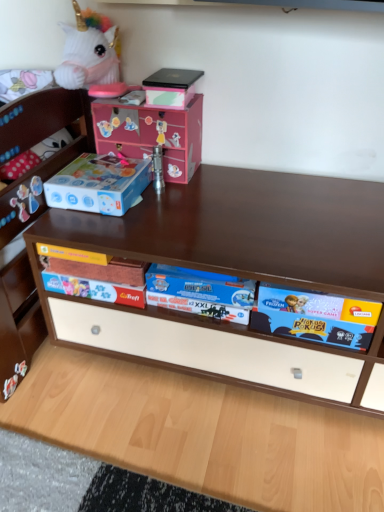
Find the location of `blue cardboard game box at center`. blue cardboard game box at center is located at coordinates (286, 313).

This screenshot has height=512, width=384. What do you see at coordinates (171, 87) in the screenshot?
I see `matte black box at upper center` at bounding box center [171, 87].

Find the location of a particular element. blue cardboard game box at center is located at coordinates (286, 313).

Between blue cardboard storage box at left and matte black box at upper center, which one appears on the right side from the viewer's perspective?

matte black box at upper center is more to the right.

Considering their positions, is blue cardboard storage box at left located in front of or behind matte black box at upper center?

blue cardboard storage box at left is in front of matte black box at upper center.

Does blue cardboard storage box at left have a larger size compared to matte black box at upper center?

Indeed, blue cardboard storage box at left has a larger size compared to matte black box at upper center.

Is the position of pink cardboard box at upper center more distant than that of matte black box at upper center?

Yes, pink cardboard box at upper center is further from the camera.

From a real-world perspective, which object rests below the other?

In real-world perspective, pink cardboard box at upper center is lower.

Can you see pink cardboard box at upper center touching matte black box at upper center?

No, pink cardboard box at upper center is not beside matte black box at upper center.

Which object is positioned more to the left, pink cardboard box at upper center or matte black box at upper center?

pink cardboard box at upper center.

Consider the image. From the image's perspective, who appears lower, pink cardboard box at upper center or blue cardboard game box at center?

blue cardboard game box at center appears lower in the image.

Is pink cardboard box at upper center touching blue cardboard game box at center?

No, pink cardboard box at upper center is not making contact with blue cardboard game box at center.

Can you tell me how much pink cardboard box at upper center and blue cardboard game box at center differ in facing direction?

0.0483 degrees.

Which object is positioned more to the left, pink cardboard box at upper center or blue cardboard game box at center?

pink cardboard box at upper center.

Measure the distance from pink cardboard box at upper center to blue cardboard storage box at left.

pink cardboard box at upper center and blue cardboard storage box at left are 12.67 centimeters apart.

Consider the image. Are pink cardboard box at upper center and blue cardboard storage box at left located far from each other?

pink cardboard box at upper center is near blue cardboard storage box at left, not far away.

Consider the image. From the image's perspective, is pink cardboard box at upper center located above or below blue cardboard storage box at left?

pink cardboard box at upper center is above blue cardboard storage box at left.

Which is further, (196,133) or (118,207)?

The point (196,133) is farther.

Does blue cardboard storage box at left have a greater height compared to blue cardboard game box at center?

Incorrect, the height of blue cardboard storage box at left is not larger of that of blue cardboard game box at center.

How far apart are blue cardboard storage box at left and blue cardboard game box at center?

blue cardboard storage box at left and blue cardboard game box at center are 11.80 inches apart from each other.

Is blue cardboard game box at center at the back of blue cardboard storage box at left?

No, blue cardboard storage box at left is not facing the opposite direction of blue cardboard game box at center.

Considering the sizes of objects blue cardboard storage box at left and blue cardboard game box at center in the image provided, who is bigger, blue cardboard storage box at left or blue cardboard game box at center?

blue cardboard game box at center.

Which point is more forward, (169, 94) or (316, 321)?

The point (316, 321) is more forward.

In the scene shown: Is matte black box at upper center not close to blue cardboard game box at center?

No, matte black box at upper center is not far away from blue cardboard game box at center.

From the image's perspective, would you say matte black box at upper center is shown under blue cardboard game box at center?

No.

From a real-world perspective, which object stands above the other?

From a 3D spatial view, matte black box at upper center is above.

In the image, is blue cardboard game box at center on the left side or the right side of blue cardboard storage box at left?

Based on their positions, blue cardboard game box at center is located to the right of blue cardboard storage box at left.

Which of these two, blue cardboard game box at center or blue cardboard storage box at left, stands taller?

Standing taller between the two is blue cardboard game box at center.

Is blue cardboard game box at center completely or partially outside of blue cardboard storage box at left?

That's correct, blue cardboard game box at center is outside of blue cardboard storage box at left.

Is point (219, 295) closer or farther from the camera than point (81, 169)?

Point (219, 295) is closer to the camera than point (81, 169).

Where is `storage box in front of the matte black box at upper center`? storage box in front of the matte black box at upper center is located at coordinates (99, 184).

Locate an element on the screen. This screenshot has height=512, width=384. box above the pink cardboard box at upper center (from a real-world perspective) is located at coordinates (171, 87).

Which object lies further to the anchor point blue cardboard storage box at left, pink cardboard box at upper center or blue cardboard game box at center?

Based on the image, blue cardboard game box at center appears to be further to blue cardboard storage box at left.

When comparing their distances from matte black box at upper center, does blue cardboard storage box at left or blue cardboard game box at center seem further?

Based on the image, blue cardboard game box at center appears to be further to matte black box at upper center.

Looking at the image, which one is located further to pink cardboard box at upper center, blue cardboard storage box at left or blue cardboard game box at center?

Among the two, blue cardboard game box at center is located further to pink cardboard box at upper center.

Looking at the image, which one is located further to blue cardboard storage box at left, pink cardboard box at upper center or matte black box at upper center?

Based on the image, matte black box at upper center appears to be further to blue cardboard storage box at left.

Which object lies further to the anchor point blue cardboard game box at center, pink cardboard box at upper center or blue cardboard storage box at left?

Based on the image, pink cardboard box at upper center appears to be further to blue cardboard game box at center.

When comparing their distances from pink cardboard box at upper center, does blue cardboard storage box at left or matte black box at upper center seem closer?

Based on the image, matte black box at upper center appears to be nearer to pink cardboard box at upper center.

Considering their positions, is matte black box at upper center positioned closer to blue cardboard game box at center than blue cardboard storage box at left?

blue cardboard storage box at left.

Which object lies nearer to the anchor point matte black box at upper center, blue cardboard game box at center or blue cardboard storage box at left?

blue cardboard storage box at left lies closer to matte black box at upper center than the other object.

At what (x,y) coordinates should I click in order to perform the action: click on cardboard box that lies between matte black box at upper center and blue cardboard storage box at left from top to bottom. Please return your answer as a coordinate pair (x, y). The height and width of the screenshot is (512, 384). Looking at the image, I should click on (152, 134).

The image size is (384, 512). What are the coordinates of `cardboard box between matte black box at upper center and blue cardboard game box at center in the up-down direction` in the screenshot? It's located at (152, 134).

Locate an element on the screen. This screenshot has width=384, height=512. storage box between pink cardboard box at upper center and blue cardboard game box at center from top to bottom is located at coordinates (99, 184).

Identify the location of storage box between matte black box at upper center and blue cardboard game box at center in the up-down direction. Image resolution: width=384 pixels, height=512 pixels. (99, 184).